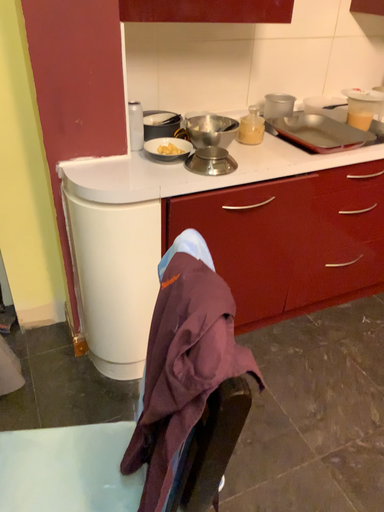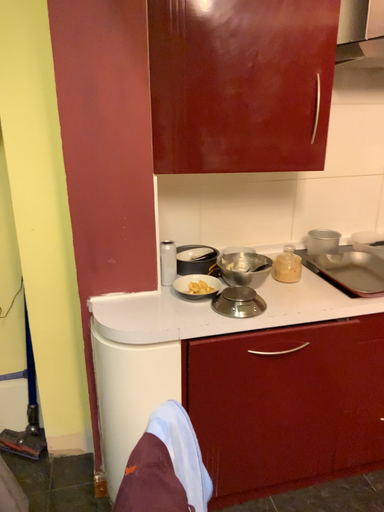
Question: How did the camera likely rotate when shooting the video?

Choices:
 (A) rotated downward
 (B) rotated upward

Answer: (B)